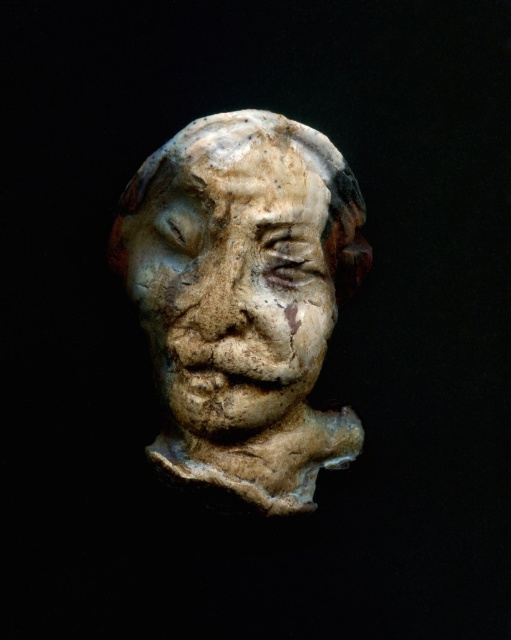
Question: Among these objects, which one is nearest to the camera?

Choices:
 (A) white clay head at center
 (B) speckled clay face at center

Answer: (B)

Question: Does white clay head at center lie behind speckled clay face at center?

Choices:
 (A) no
 (B) yes

Answer: (B)

Question: Does white clay head at center appear over speckled clay face at center?

Choices:
 (A) no
 (B) yes

Answer: (A)

Question: Is white clay head at center to the left of speckled clay face at center from the viewer's perspective?

Choices:
 (A) yes
 (B) no

Answer: (B)